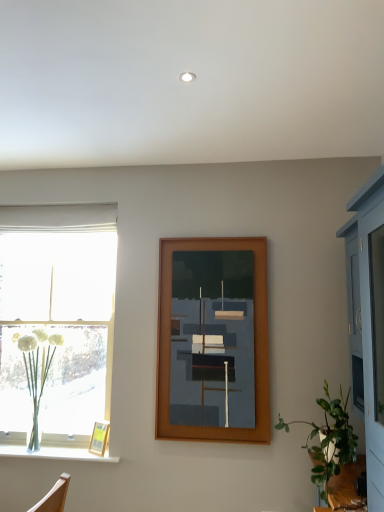
At what (x,y) coordinates should I click in order to perform the action: click on free space to the left of wooden picture frame at lower left, placed as the first picture frame when sorted from left to right. Please return your answer as a coordinate pair (x, y). This screenshot has height=512, width=384. Looking at the image, I should click on (76, 456).